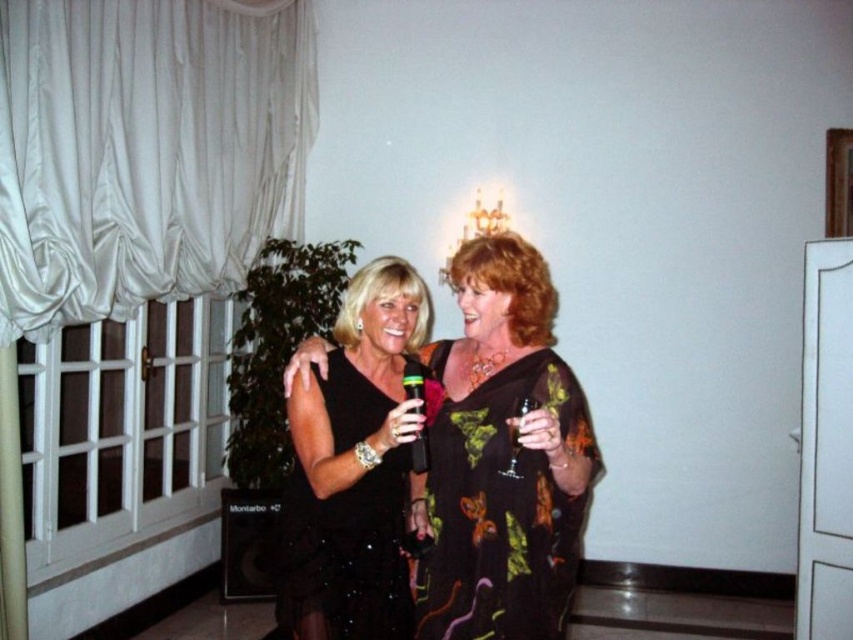
You are a photographer standing at the camera position. You want to take a closeup shot of the translucent plastic wine glass at center. What is the minimum distance you need to move forward to focus on the wine glass?

The minimum distance you need to move forward is 1.94 meters to focus on the translucent plastic wine glass at center.

You are a photographer setting up for an event. You need to position a wide enough backdrop to cover both the black satin dress at center and the clear glass wine glass at center. Given that the backdrop can only extend 1.2 meters in width, will it be sufficient to cover both items based on their sizes?

The black satin dress at center is wider than the clear glass wine glass at center. Since the backdrop can extend 1.2 meters, it should be sufficient to cover both items as long as their combined width does not exceed the backdrop width. However, the exact dimensions are not provided, so this depends on their actual sizes.

You are a photographer at a fashion show and need to capture a clear shot of both the floral print fabric dress at center and the black sequined dress at center. Since you can only focus on one dress at a time, which dress should you focus on to ensure the other is still somewhat in focus?

You should focus on the floral print fabric dress at center because it is closer to the viewer than the black sequined dress at center, so focusing on the closer one will keep the farther one more in focus compared to the reverse.